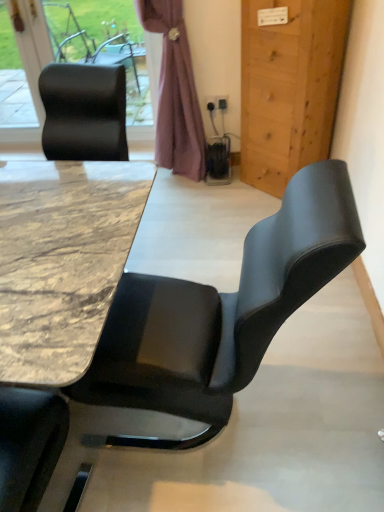
Question: Should I look upward or downward to see marble/black at center?

Choices:
 (A) down
 (B) up

Answer: (A)

Question: Considering the relative positions of black leather chair at upper left and wooden door at right in the image provided, is black leather chair at upper left in front of wooden door at right?

Choices:
 (A) yes
 (B) no

Answer: (B)

Question: Can you confirm if black leather chair at upper left is positioned to the left of wooden door at right?

Choices:
 (A) no
 (B) yes

Answer: (B)

Question: Does black leather chair at upper left have a lesser height compared to wooden door at right?

Choices:
 (A) yes
 (B) no

Answer: (A)

Question: Is black leather chair at upper left far away from wooden door at right?

Choices:
 (A) yes
 (B) no

Answer: (A)

Question: From the image's perspective, is black leather chair at upper left beneath wooden door at right?

Choices:
 (A) no
 (B) yes

Answer: (A)

Question: Does black leather chair at upper left have a larger size compared to wooden door at right?

Choices:
 (A) no
 (B) yes

Answer: (A)

Question: Considering the relative sizes of black leather chair at upper left and marble/black at center in the image provided, is black leather chair at upper left taller than marble/black at center?

Choices:
 (A) no
 (B) yes

Answer: (B)

Question: From a real-world perspective, does black leather chair at upper left sit lower than marble/black at center?

Choices:
 (A) yes
 (B) no

Answer: (B)

Question: From a real-world perspective, is black leather chair at upper left over marble/black at center?

Choices:
 (A) no
 (B) yes

Answer: (B)

Question: Is black leather chair at upper left positioned before marble/black at center?

Choices:
 (A) yes
 (B) no

Answer: (B)

Question: Can you confirm if black leather chair at upper left is thinner than marble/black at center?

Choices:
 (A) no
 (B) yes

Answer: (B)

Question: Considering the relative sizes of black leather chair at upper left and marble/black at center in the image provided, is black leather chair at upper left bigger than marble/black at center?

Choices:
 (A) no
 (B) yes

Answer: (A)

Question: Could you tell me if marble/black at center is facing purple fabric curtain at upper center?

Choices:
 (A) no
 (B) yes

Answer: (A)